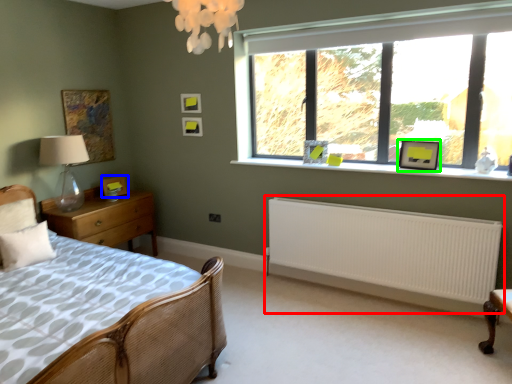
Question: Estimate the real-world distances between objects in this image. Which object is closer to radiator (highlighted by a red box), picture frame (highlighted by a blue box) or picture frame (highlighted by a green box)?

Choices:
 (A) picture frame
 (B) picture frame

Answer: (B)